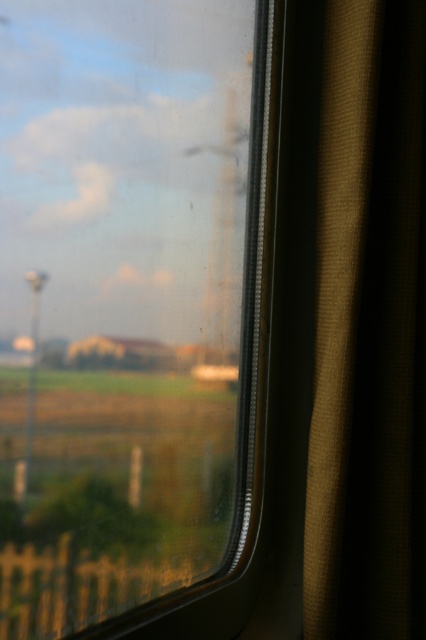
Does transparent glass train window at center appear on the right side of brown textured curtain at right?

In fact, transparent glass train window at center is to the left of brown textured curtain at right.

Where is `transparent glass train window at center`? The height and width of the screenshot is (640, 426). transparent glass train window at center is located at coordinates (124, 301).

You are a GUI agent. You are given a task and a screenshot of the screen. Output one action in this format:
    pyautogui.click(x=<x>, y=<y>)
    Task: Click on the transparent glass train window at center
    
    Given the screenshot: What is the action you would take?
    pyautogui.click(x=124, y=301)